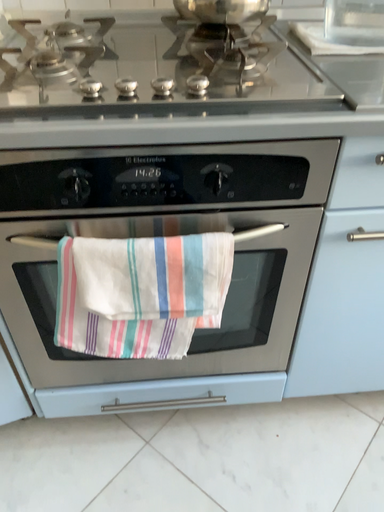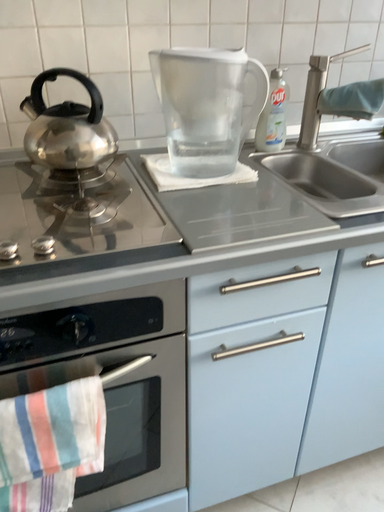
Question: How did the camera likely rotate when shooting the video?

Choices:
 (A) rotated left
 (B) rotated right

Answer: (B)